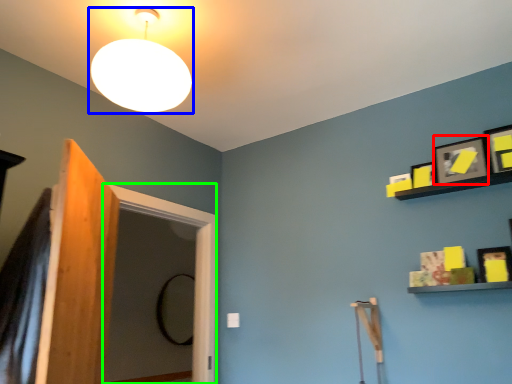
Question: Which is farther away from picture frame (highlighted by a red box)? lamp (highlighted by a blue box) or screen door (highlighted by a green box)?

Choices:
 (A) lamp
 (B) screen door

Answer: (B)